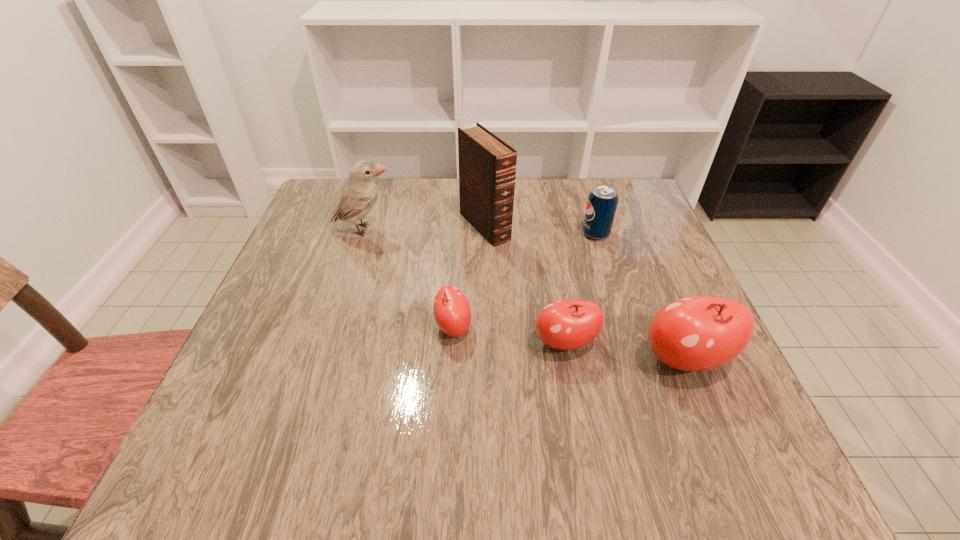
Where is `free space for a new apple on the left`? This screenshot has height=540, width=960. free space for a new apple on the left is located at coordinates (348, 313).